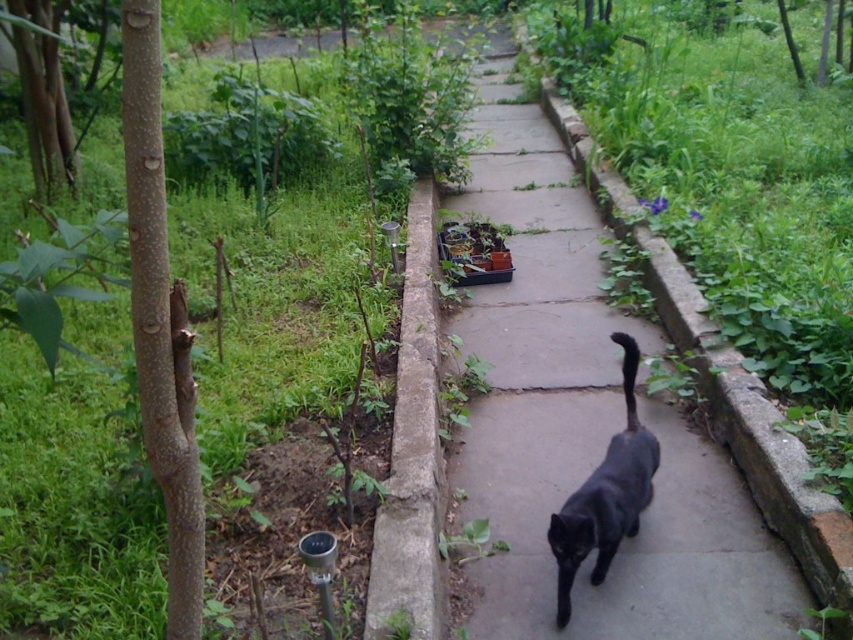
Can you confirm if green leafy plant at upper left is positioned to the left of concrete at center?

Correct, you'll find green leafy plant at upper left to the left of concrete at center.

Is green leafy plant at upper left wider than concrete at center?

Correct, the width of green leafy plant at upper left exceeds that of concrete at center.

Identify the location of green leafy plant at upper left. The width and height of the screenshot is (853, 640). (74, 429).

Is green leafy plant at upper left behind black matte cat at center?

No, green leafy plant at upper left is closer to the viewer.

Is point (10, 608) positioned in front of point (641, 438)?

Yes, point (10, 608) is in front of point (641, 438).

Locate an element on the screen. The width and height of the screenshot is (853, 640). green leafy plant at upper left is located at coordinates (74, 429).

Who is more forward, [668,637] or [563,609]?

Point [668,637]

Between point (468, 195) and point (572, 525), which one is positioned behind?

The point (468, 195) is more distant.

In order to click on concrete at center in this screenshot , I will do `click(587, 426)`.